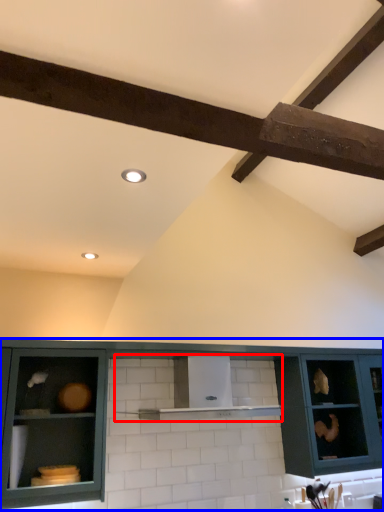
Question: Which of the following is the closest to the observer, shelf (highlighted by a red box) or cabinetry (highlighted by a blue box)?

Choices:
 (A) shelf
 (B) cabinetry

Answer: (B)